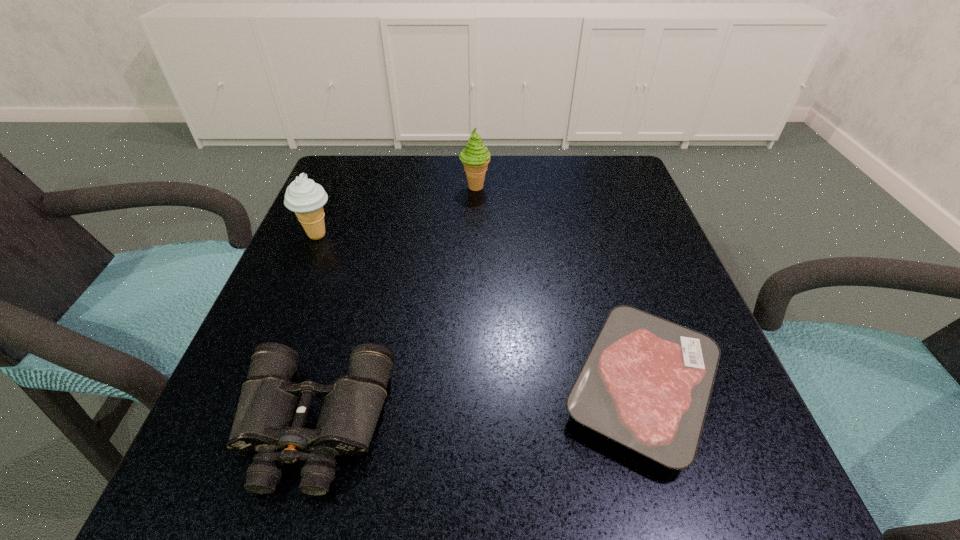
Find the location of a particular element. Image resolution: width=960 pixels, height=540 pixels. free space at the left edge of the desktop is located at coordinates (376, 237).

Identify the location of vacant space at the right edge. The width and height of the screenshot is (960, 540). (602, 309).

This screenshot has height=540, width=960. I want to click on vacant space at the far left corner of the desktop, so click(x=347, y=165).

Image resolution: width=960 pixels, height=540 pixels. I want to click on vacant region at the far right corner of the desktop, so click(603, 195).

Where is `free spot between the rightmost object and the second shortest object`? Image resolution: width=960 pixels, height=540 pixels. free spot between the rightmost object and the second shortest object is located at coordinates (478, 406).

Where is `vacant area that lies between the second shortest object and the left icecream`? The image size is (960, 540). vacant area that lies between the second shortest object and the left icecream is located at coordinates (316, 330).

The height and width of the screenshot is (540, 960). Identify the location of vacant space in between the second farthest object and the steak. (480, 311).

You are a GUI agent. You are given a task and a screenshot of the screen. Output one action in this format:
    pyautogui.click(x=<x>, y=<y>)
    Task: Click on the unoccupied area between the steak and the second farthest object
    The height and width of the screenshot is (540, 960).
    Given the screenshot: What is the action you would take?
    pyautogui.click(x=480, y=311)

Where is `vacant area between the nearer icecream and the shortest object`? vacant area between the nearer icecream and the shortest object is located at coordinates (480, 311).

In order to click on free spot between the right icecream and the left icecream in this screenshot , I will do `click(396, 211)`.